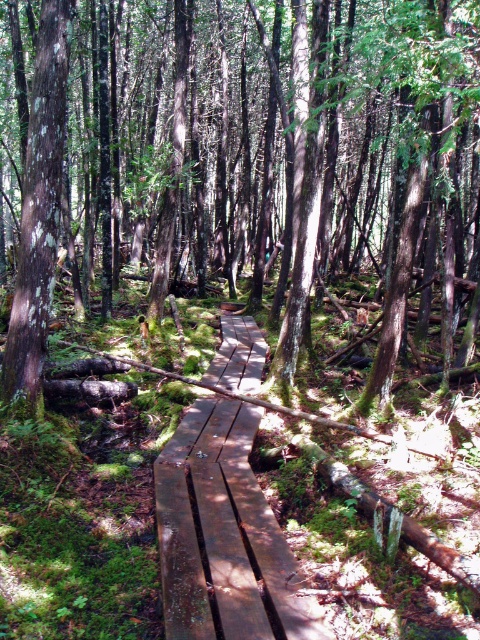
You are a hiker trying to cross the forest. You see a smooth brown wooden boardwalk at center and a smooth brown wooden bridge at center. Which one is located to the left of the other?

The smooth brown wooden boardwalk at center is positioned on the left side of the smooth brown wooden bridge at center.

You are a hiker who wants to cross the forest path. You see the smooth brown wooden boardwalk at center and the smooth brown wooden bridge at center. Which one is higher above the ground?

The smooth brown wooden boardwalk at center is taller than the smooth brown wooden bridge at center, so the boardwalk is higher above the ground.